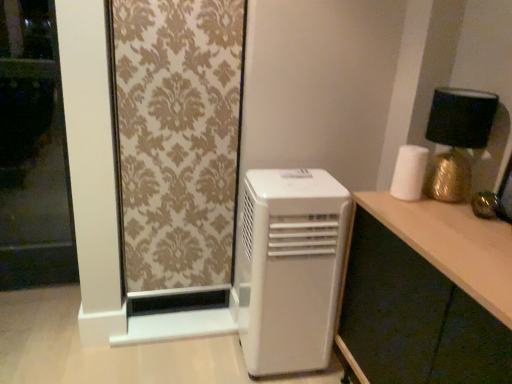
Image resolution: width=512 pixels, height=384 pixels. Identify the location of free area below gold metallic table lamp at upper right (from a real-world perspective). (450, 203).